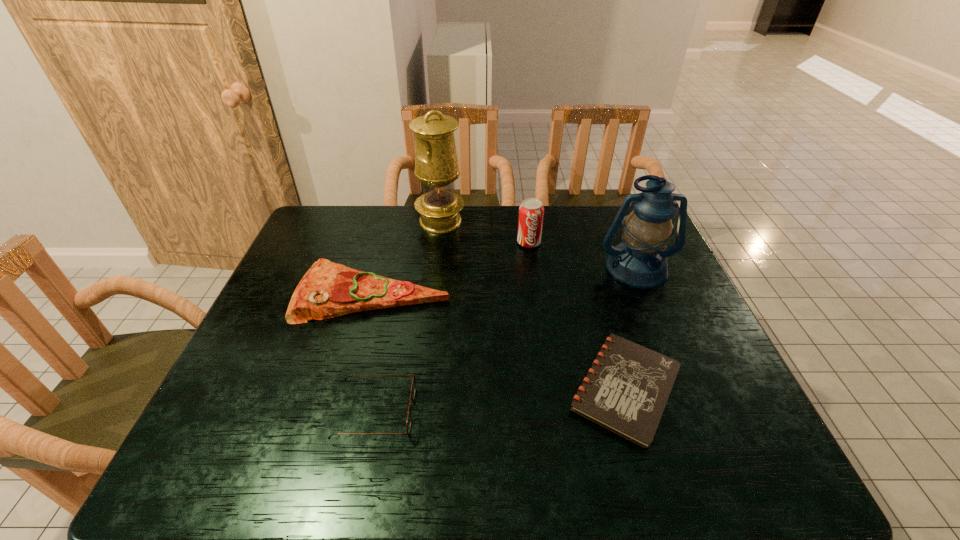
Find the location of a particular element. This screenshot has width=960, height=540. free space between the shortest object and the fourth shortest object is located at coordinates (577, 315).

You are a GUI agent. You are given a task and a screenshot of the screen. Output one action in this format:
    pyautogui.click(x=<x>, y=<y>)
    Task: Click on the free space between the notebook and the pizza
    
    Given the screenshot: What is the action you would take?
    pyautogui.click(x=499, y=341)

At what (x,y) coordinates should I click in order to perform the action: click on vacant point located between the soda can and the tallest object. Please return your answer as a coordinate pair (x, y). The width and height of the screenshot is (960, 540). Looking at the image, I should click on (485, 232).

At what (x,y) coordinates should I click in order to perform the action: click on vacant space in between the soda can and the sunglasses. Please return your answer as a coordinate pair (x, y). Image resolution: width=960 pixels, height=540 pixels. Looking at the image, I should click on (452, 327).

Locate an element on the screen. The image size is (960, 540). vacant area that lies between the lantern and the pizza is located at coordinates (505, 281).

Locate an element on the screen. The height and width of the screenshot is (540, 960). the third closest object to the lantern is located at coordinates (436, 165).

Select which object appears as the third closest to the lantern. Please provide its 2D coordinates. Your answer should be formatted as a tuple, i.e. [(x, y)], where the tuple contains the x and y coordinates of a point satisfying the conditions above.

[(436, 165)]

Where is `free point that satisfies the following two spatial constraints: 1. on the back side of the pizza; 2. on the left side of the tallest object`? The height and width of the screenshot is (540, 960). free point that satisfies the following two spatial constraints: 1. on the back side of the pizza; 2. on the left side of the tallest object is located at coordinates (393, 221).

Where is `vacant area that satisfies the following two spatial constraints: 1. on the face of the second tallest object; 2. on the front-facing side of the sunglasses`? The image size is (960, 540). vacant area that satisfies the following two spatial constraints: 1. on the face of the second tallest object; 2. on the front-facing side of the sunglasses is located at coordinates (696, 412).

Identify the location of free space that satisfies the following two spatial constraints: 1. on the face of the lantern; 2. on the front-facing side of the sunglasses. The width and height of the screenshot is (960, 540). (696, 412).